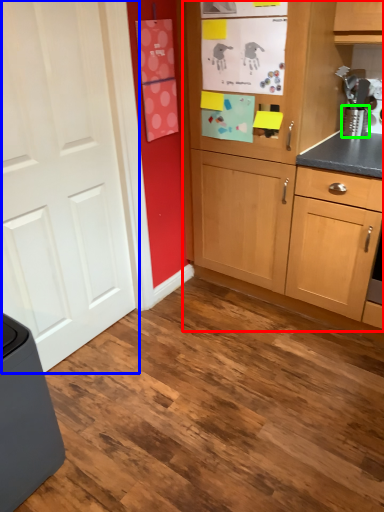
Question: Which object is positioned closest to cabinetry (highlighted by a red box)? Select from door (highlighted by a blue box) and appliance (highlighted by a green box).

Choices:
 (A) door
 (B) appliance

Answer: (B)